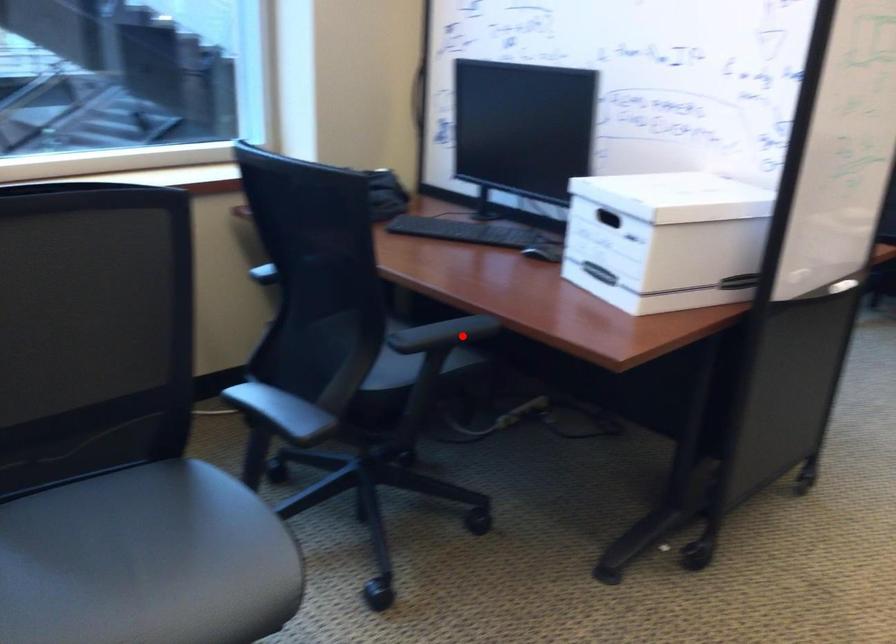
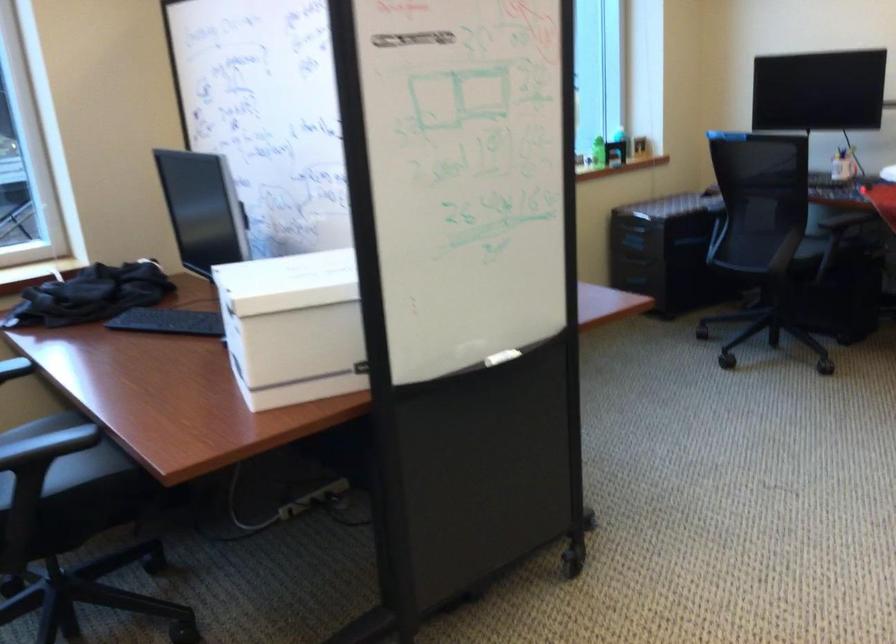
Find the pixel in the second image that matches the highlighted location in the first image.

(47, 446)